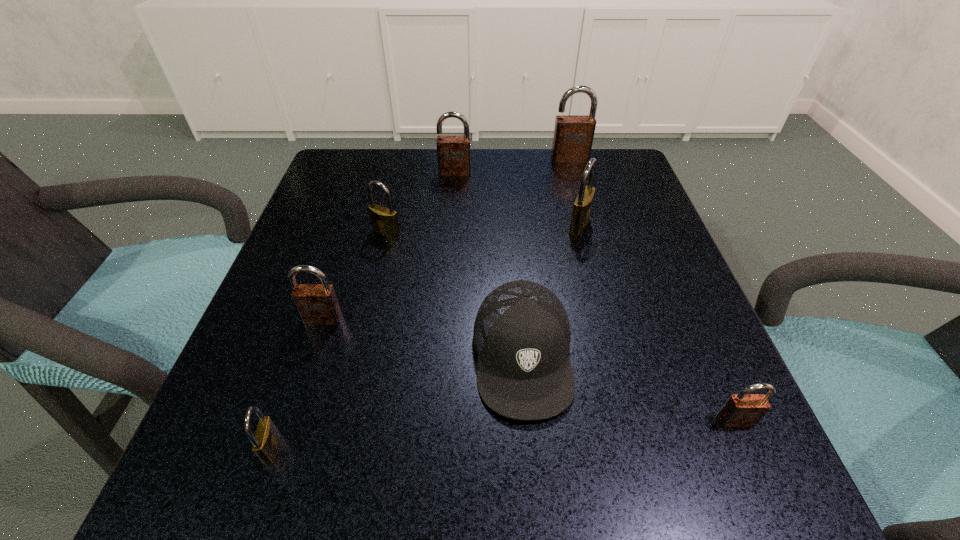
Where is `the nearest padlock`? The image size is (960, 540). the nearest padlock is located at coordinates (266, 440).

Find the location of a particular element. The height and width of the screenshot is (540, 960). the nearest object is located at coordinates (266, 440).

Locate an element on the screen. This screenshot has width=960, height=540. the nearest brown padlock is located at coordinates (741, 410).

Identify the location of the rightmost object. The width and height of the screenshot is (960, 540). (741, 410).

The width and height of the screenshot is (960, 540). I want to click on vacant space positioned on the front-facing side of the farthest padlock, so click(x=588, y=228).

Locate an element on the screen. This screenshot has width=960, height=540. vacant space located 0.050m on the front of the biggest brass padlock is located at coordinates (x=587, y=253).

The width and height of the screenshot is (960, 540). I want to click on free space located 0.390m on the front-facing side of the third brown padlock from right to left, so click(445, 301).

The height and width of the screenshot is (540, 960). Find the location of `vacant position located on the left of the fifth padlock from right to left`. vacant position located on the left of the fifth padlock from right to left is located at coordinates (332, 233).

This screenshot has height=540, width=960. What are the coordinates of `vacant area situated on the front-facing side of the fifth farthest padlock` in the screenshot? It's located at (277, 460).

Identify the location of blank space located 0.060m on the front-facing side of the fifth object from left to right. This screenshot has height=540, width=960. (532, 469).